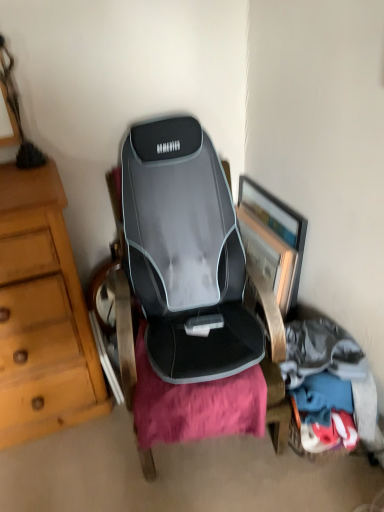
Question: Is soft cotton clothes at lower right situated inside wooden framed picture at center right or outside?

Choices:
 (A) inside
 (B) outside

Answer: (B)

Question: Is soft cotton clothes at lower right taller or shorter than wooden framed picture at center right?

Choices:
 (A) tall
 (B) short

Answer: (B)

Question: Is soft cotton clothes at lower right wider or thinner than wooden framed picture at center right?

Choices:
 (A) thin
 (B) wide

Answer: (A)

Question: Based on their positions, is wooden framed picture at center right located to the left or right of soft cotton clothes at lower right?

Choices:
 (A) right
 (B) left

Answer: (B)

Question: Considering the positions of wooden framed picture at center right and soft cotton clothes at lower right in the image, is wooden framed picture at center right wider or thinner than soft cotton clothes at lower right?

Choices:
 (A) wide
 (B) thin

Answer: (A)

Question: From a real-world perspective, is wooden framed picture at center right physically located above or below soft cotton clothes at lower right?

Choices:
 (A) above
 (B) below

Answer: (A)

Question: Considering the positions of wooden framed picture at center right and soft cotton clothes at lower right in the image, is wooden framed picture at center right taller or shorter than soft cotton clothes at lower right?

Choices:
 (A) short
 (B) tall

Answer: (B)